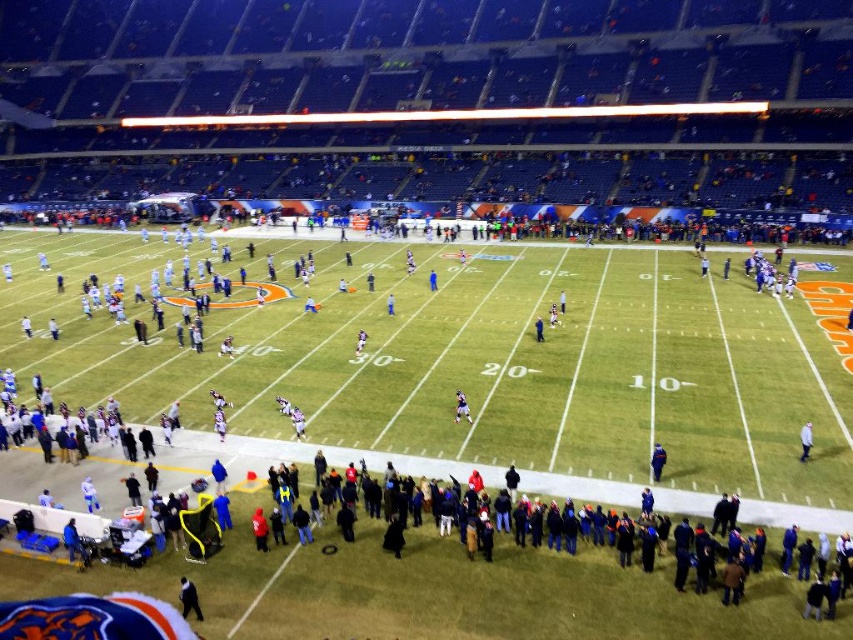
Image resolution: width=853 pixels, height=640 pixels. Describe the element at coordinates (461, 406) in the screenshot. I see `dark blue jersey at center` at that location.

Between dark blue jersey at center and blue fabric jacket at center, which one is positioned higher?

blue fabric jacket at center is higher up.

Is point (459, 416) farther from viewer compared to point (537, 340)?

No, it is in front of (537, 340).

This screenshot has height=640, width=853. Find the location of `dark blue jersey at center`. dark blue jersey at center is located at coordinates (461, 406).

Between point (807, 445) and point (540, 321), which one is positioned in front?

Point (807, 445) is more forward.

Who is lower down, white matte jacket at lower right or blue fabric jacket at center?

Positioned lower is white matte jacket at lower right.

Is point (809, 433) positioned after point (538, 321)?

No, it is not.

You are a GUI agent. You are given a task and a screenshot of the screen. Output one action in this format:
    pyautogui.click(x=<x>, y=<y>)
    Task: Click on the white matte jacket at lower right
    
    Given the screenshot: What is the action you would take?
    pyautogui.click(x=805, y=440)

Is black matte jacket at lower center taller than white matte jacket at lower right?

Incorrect, black matte jacket at lower center's height is not larger of white matte jacket at lower right's.

Image resolution: width=853 pixels, height=640 pixels. What do you see at coordinates (189, 598) in the screenshot?
I see `black matte jacket at lower center` at bounding box center [189, 598].

At what (x,y) coordinates should I click in order to perform the action: click on black matte jacket at lower center. Please return your answer as a coordinate pair (x, y). The width and height of the screenshot is (853, 640). Looking at the image, I should click on (189, 598).